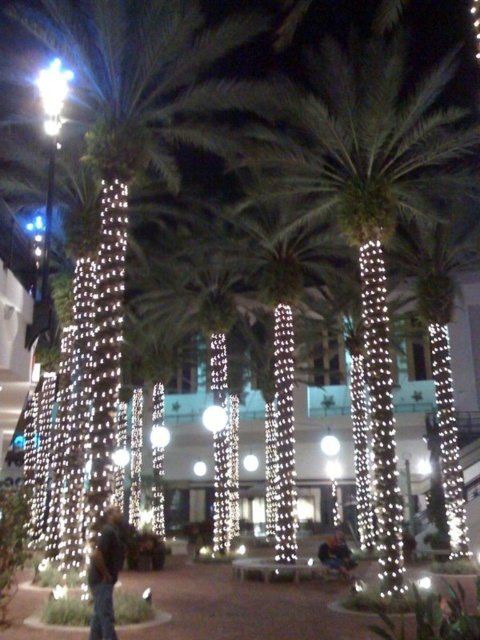
Who is more forward, (447, 60) or (455, 436)?

Point (447, 60) is in front.

Who is positioned more to the left, green leafy palm tree at center or illuminated string lights at center?

From the viewer's perspective, green leafy palm tree at center appears more on the left side.

Between point (372, 60) and point (442, 362), which one is positioned in front?

Point (372, 60) is in front.

The image size is (480, 640). In order to click on green leafy palm tree at center in this screenshot , I will do `click(364, 202)`.

Can you confirm if illuminated string lights at center is shorter than dark blue jeans at center?

No.

Which of these two, illuminated string lights at center or dark blue jeans at center, stands taller?

With more height is illuminated string lights at center.

Is point (456, 296) behind point (99, 614)?

Yes, it is.

Find the location of a particular element. The width and height of the screenshot is (480, 640). illuminated string lights at center is located at coordinates (440, 337).

Describe the element at coordinates (278, 321) in the screenshot. I see `illuminated white palm tree at center` at that location.

Describe the element at coordinates (278, 321) in the screenshot. The height and width of the screenshot is (640, 480). I see `illuminated white palm tree at center` at that location.

At what (x,y) coordinates should I click in order to perform the action: click on illuminated white palm tree at center. Please return your answer as a coordinate pair (x, y). This screenshot has width=480, height=640. Looking at the image, I should click on (278, 321).